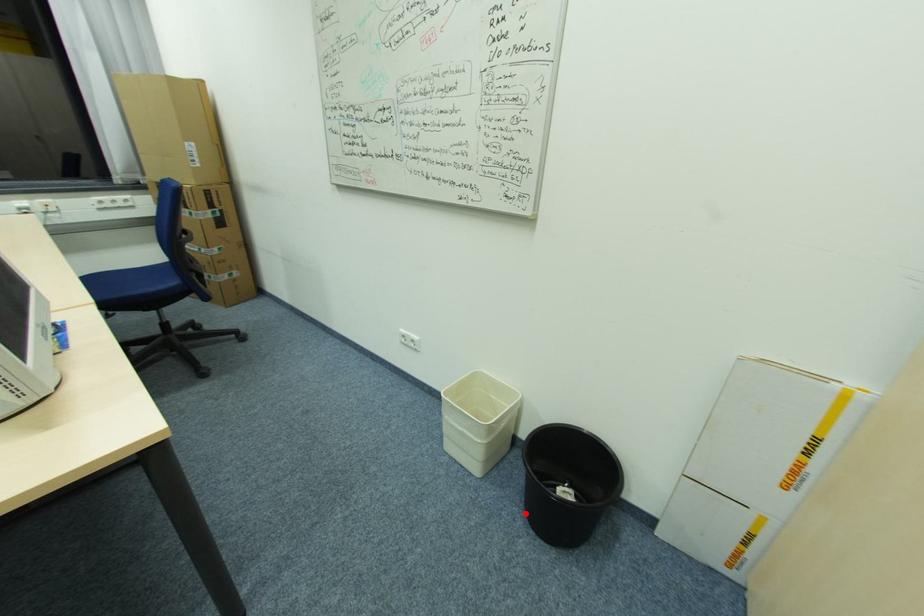
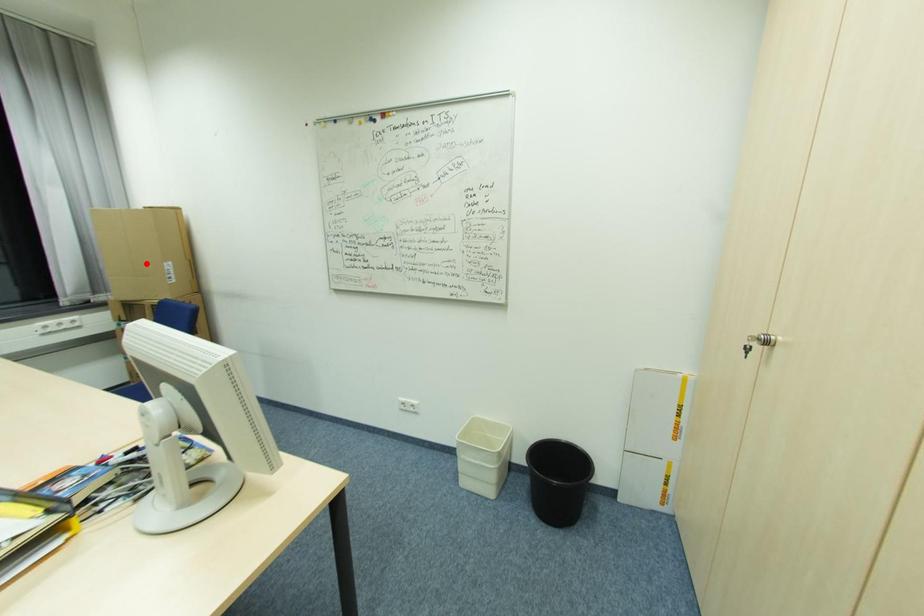
I am providing you with two images of the same scene from different viewpoints. A red point is marked on the first image and another point is marked on the second image. Does the point marked in image1 correspond to the same location as the one in image2?

No